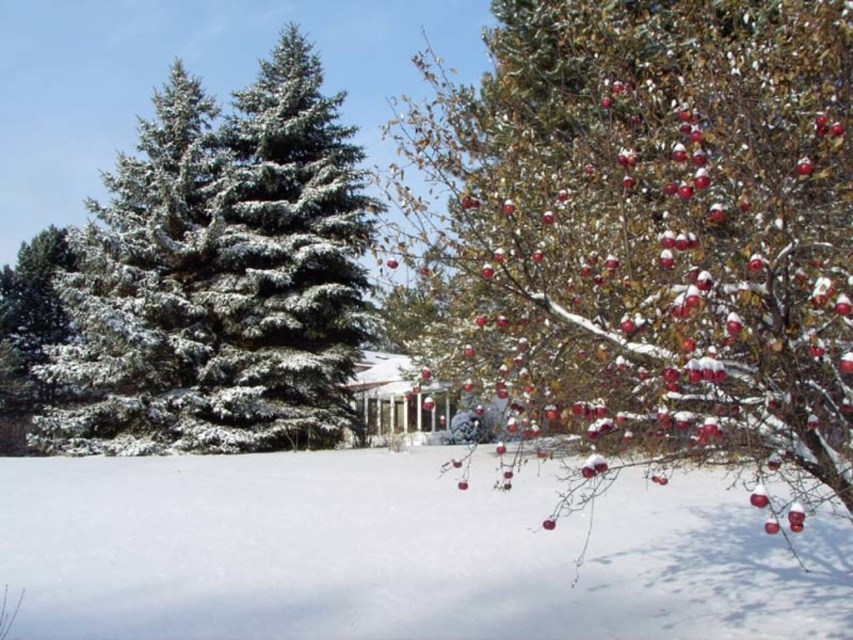
Locate an element on the screen. The height and width of the screenshot is (640, 853). white fluffy snow at lower center is located at coordinates (396, 554).

Which is behind, point (76, 572) or point (207, 138)?

The point (207, 138) is more distant.

This screenshot has height=640, width=853. In order to click on white fluffy snow at lower center in this screenshot , I will do `click(396, 554)`.